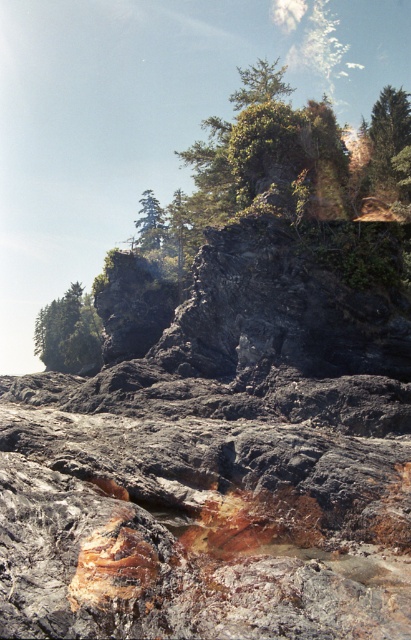
Who is higher up, green matte tree at left or green matte tree at upper right?

green matte tree at upper right is higher up.

Is point (80, 326) positioned before point (387, 147)?

No, it is behind (387, 147).

Image resolution: width=411 pixels, height=640 pixels. Identify the location of green matte tree at left. (69, 333).

Does green matte tree at left appear on the right side of green matte tree at upper center?

Correct, you'll find green matte tree at left to the right of green matte tree at upper center.

Does point (67, 323) come closer to viewer compared to point (138, 211)?

Yes.

Which is behind, point (66, 294) or point (152, 209)?

The point (66, 294) is behind.

Identify the location of green matte tree at left. (69, 333).

Who is lower down, green leafy tree at center or green matte tree at upper right?

green leafy tree at center

How much distance is there between green leafy tree at center and green matte tree at upper right?

They are 18.95 meters apart.

Is point (180, 208) positioned before point (383, 129)?

That is False.

The image size is (411, 640). I want to click on green leafy tree at center, so click(253, 221).